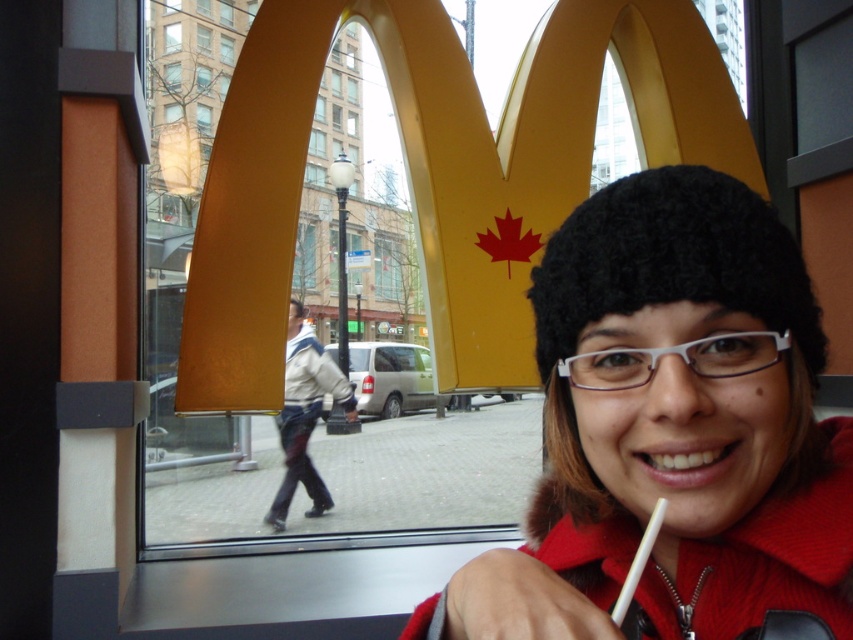
Question: Is black fuzzy hat at upper center further to the viewer compared to white fabric jacket at center?

Choices:
 (A) no
 (B) yes

Answer: (A)

Question: Can you confirm if black fuzzy hat at upper center is positioned to the right of white fabric jacket at center?

Choices:
 (A) no
 (B) yes

Answer: (B)

Question: Which of the following is the farthest from the observer?

Choices:
 (A) (599, 627)
 (B) (305, 326)

Answer: (B)

Question: Among these points, which one is nearest to the camera?

Choices:
 (A) (547, 458)
 (B) (309, 406)

Answer: (A)

Question: Is black fuzzy hat at upper center above white fabric jacket at center?

Choices:
 (A) no
 (B) yes

Answer: (B)